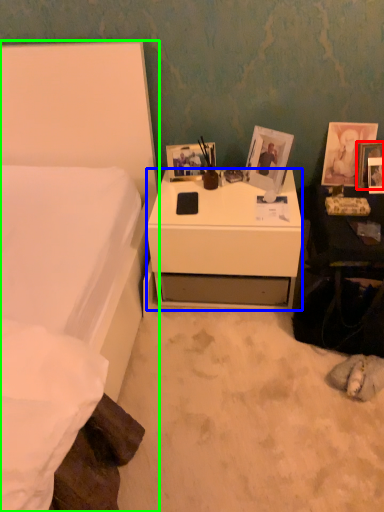
Question: Which object is positioned farthest from picture frame (highlighted by a red box)? Select from desk (highlighted by a blue box) and bed (highlighted by a green box).

Choices:
 (A) desk
 (B) bed

Answer: (B)